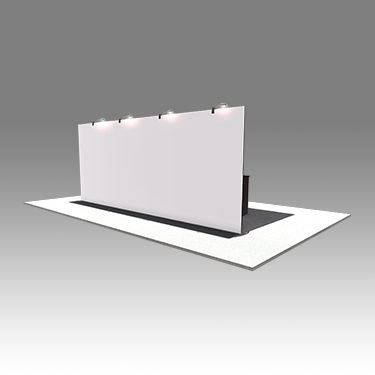
Image resolution: width=375 pixels, height=375 pixels. I want to click on back side of wall, so point(157,173).